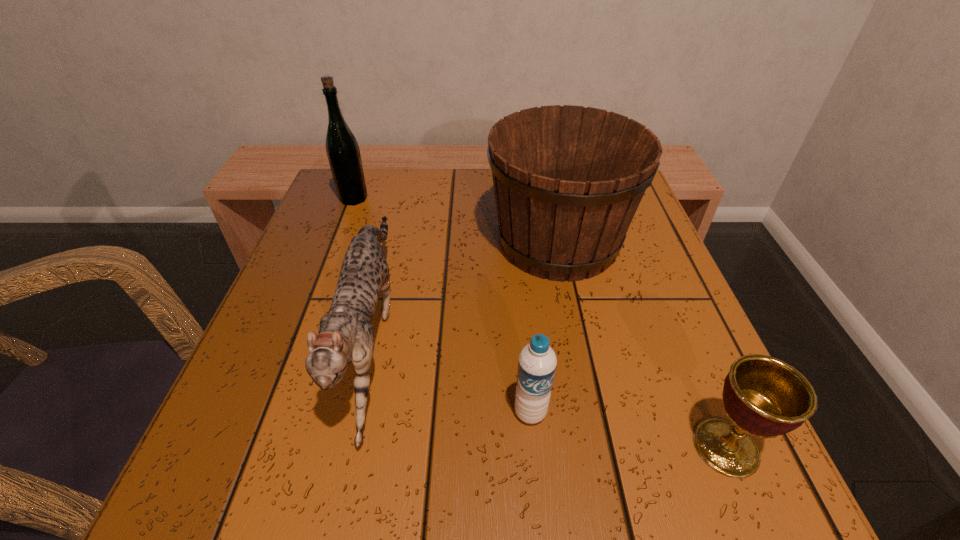
Image resolution: width=960 pixels, height=540 pixels. What are the coordinates of `free space between the water bottle and the chalice` in the screenshot? It's located at (628, 430).

The height and width of the screenshot is (540, 960). In order to click on free spot between the fourth shortest object and the water bottle in this screenshot , I will do [544, 327].

Where is `free point between the beer bottle and the chalice`? free point between the beer bottle and the chalice is located at coordinates (540, 323).

Where is `free spot between the chalice and the water bottle`? The image size is (960, 540). free spot between the chalice and the water bottle is located at coordinates (628, 430).

The image size is (960, 540). What are the coordinates of `free space between the wine bucket and the fourth object from right to left` in the screenshot? It's located at (465, 287).

Identify the location of object that stands as the closest to the beer bottle. (345, 334).

You are a GUI agent. You are given a task and a screenshot of the screen. Output one action in this format:
    pyautogui.click(x=<x>, y=<y>)
    Task: Click on the object that ranks as the second closest to the fourth object from right to left
    Image resolution: width=960 pixels, height=540 pixels.
    Given the screenshot: What is the action you would take?
    pyautogui.click(x=342, y=148)

Locate an element on the screen. The height and width of the screenshot is (540, 960). free location that satisfies the following two spatial constraints: 1. on the label of the chalice; 2. on the left side of the water bottle is located at coordinates (534, 447).

Where is `free space that satisfies the following two spatial constraints: 1. on the label of the chalice; 2. on the right side of the water bottle`? This screenshot has width=960, height=540. free space that satisfies the following two spatial constraints: 1. on the label of the chalice; 2. on the right side of the water bottle is located at coordinates (534, 447).

At what (x,y) coordinates should I click in order to perform the action: click on free region that satisfies the following two spatial constraints: 1. on the front side of the second tallest object; 2. on the right side of the chalice. Please return your answer as a coordinate pair (x, y). Looking at the image, I should click on (600, 447).